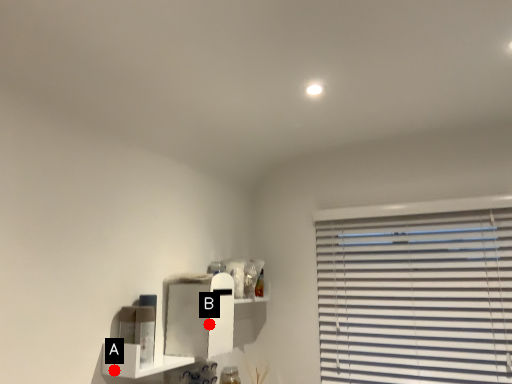
Question: Two points are circled on the image, labeled by A and B beside each circle. Which point is closer to the camera taking this photo?

Choices:
 (A) A is closer
 (B) B is closer

Answer: (A)